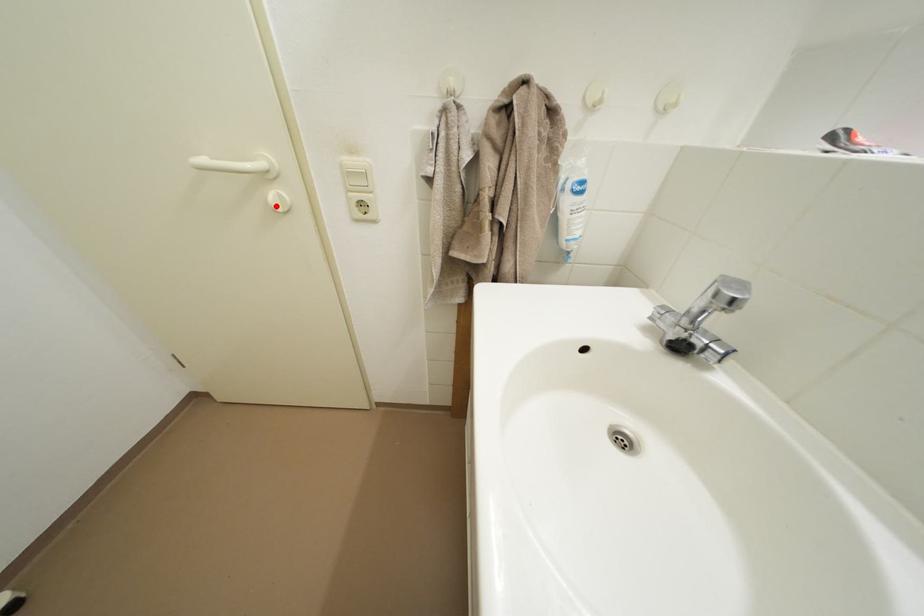
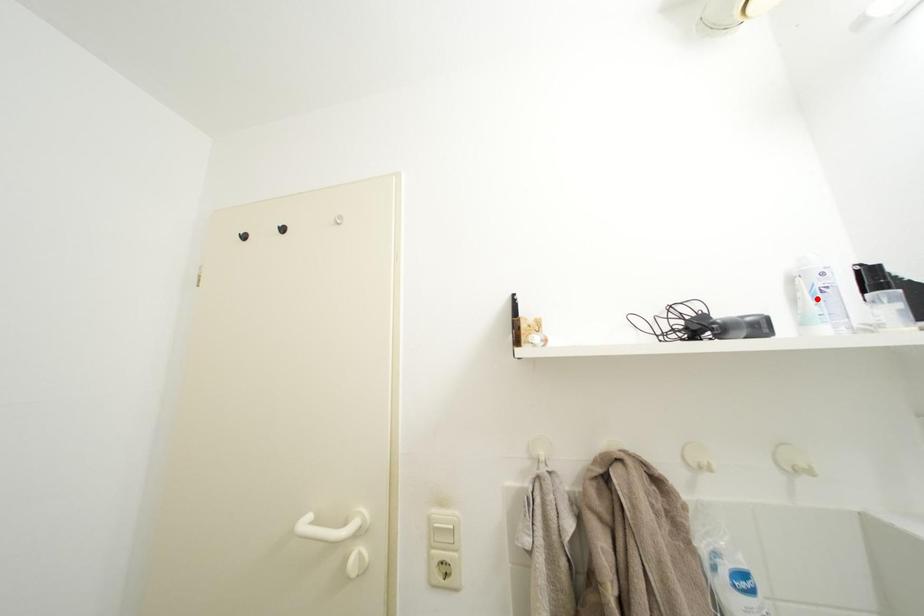
I am providing you with two images of the same scene from different viewpoints. A red point is marked on the first image and another point is marked on the second image. Does the point marked in image1 correspond to the same location as the one in image2?

No